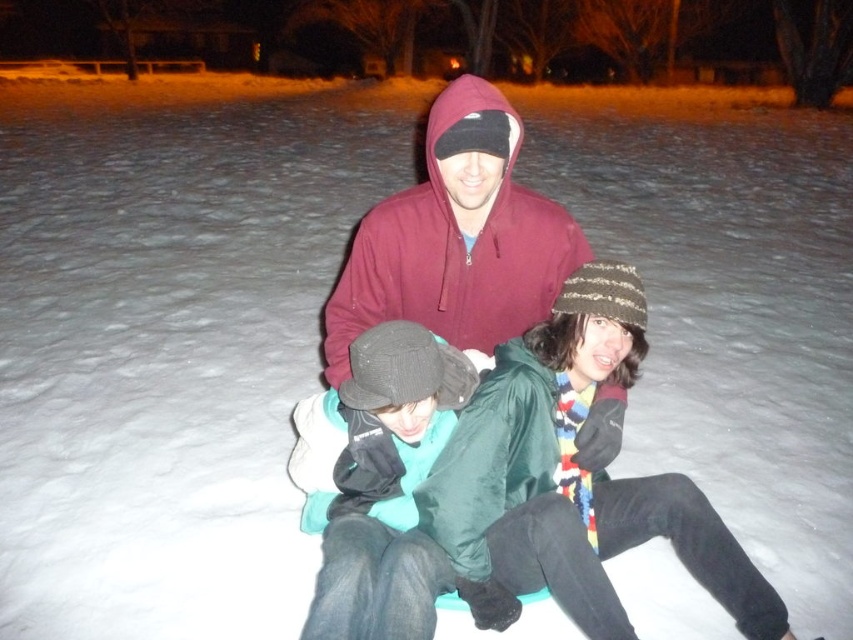
Question: Is striped knit beanie at center below maroon hoodie at center?

Choices:
 (A) yes
 (B) no

Answer: (A)

Question: Does striped knit beanie at center lie in front of maroon hoodie at center?

Choices:
 (A) yes
 (B) no

Answer: (A)

Question: Can you confirm if striped knit beanie at center is positioned above maroon hoodie at center?

Choices:
 (A) yes
 (B) no

Answer: (B)

Question: Which object appears farthest from the camera in this image?

Choices:
 (A) maroon hoodie at center
 (B) striped knit beanie at center

Answer: (A)